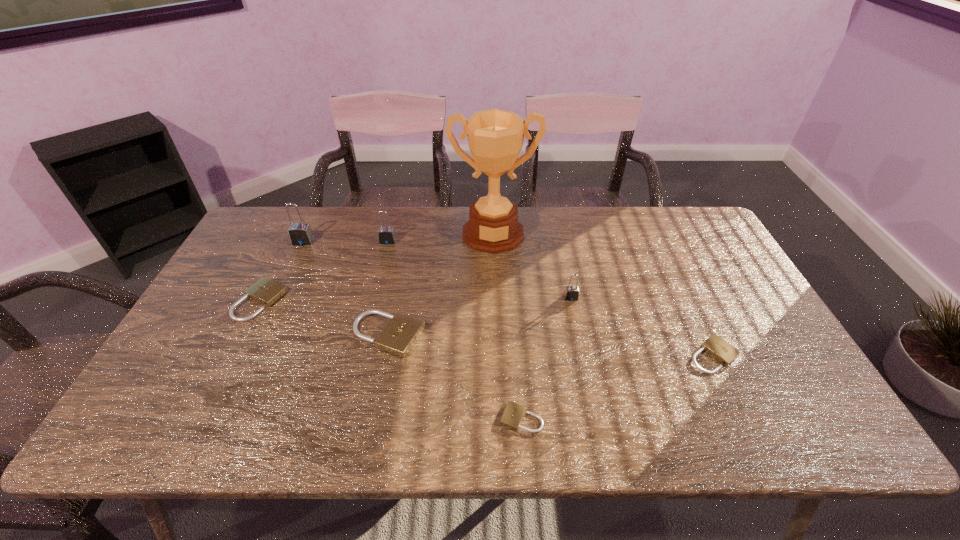
At what (x,y) coordinates should I click in order to perform the action: click on blank space at the far left corner. Please return your answer as a coordinate pair (x, y). The width and height of the screenshot is (960, 540). Looking at the image, I should click on (291, 245).

Find the location of a particular element. The height and width of the screenshot is (540, 960). vacant space at the far right corner of the desktop is located at coordinates (658, 221).

The height and width of the screenshot is (540, 960). I want to click on vacant region between the award and the second gray padlock from left to right, so click(x=441, y=238).

Where is `vacant space that is in between the leftmost gray padlock and the second gray padlock from right to left`? The height and width of the screenshot is (540, 960). vacant space that is in between the leftmost gray padlock and the second gray padlock from right to left is located at coordinates (346, 241).

Locate an element on the screen. Image resolution: width=960 pixels, height=540 pixels. free space between the second gray padlock from right to left and the fifth padlock from left to right is located at coordinates (454, 330).

The image size is (960, 540). What are the coordinates of `free space between the leftmost beige padlock and the tallest object` in the screenshot? It's located at (377, 267).

At what (x,y) coordinates should I click in order to perform the action: click on free space between the second biggest beige padlock and the biggest gray padlock. Please return your answer as a coordinate pair (x, y). The width and height of the screenshot is (960, 540). Looking at the image, I should click on (282, 272).

At what (x,y) coordinates should I click in order to perform the action: click on free spot between the rightmost gray padlock and the leftmost beige padlock. Please return your answer as a coordinate pair (x, y). Image resolution: width=960 pixels, height=540 pixels. Looking at the image, I should click on (416, 300).

Find the location of a particular element. The height and width of the screenshot is (540, 960). vacant area that lies between the third smallest beige padlock and the biggest gray padlock is located at coordinates (282, 272).

Identify the location of empty space that is in between the third tallest object and the third tallest padlock. (479, 269).